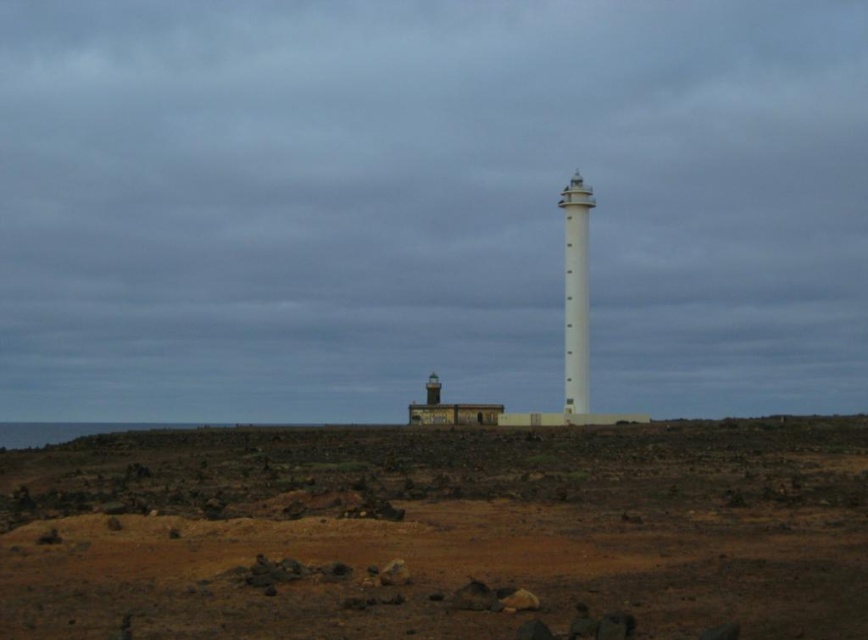
Question: Is brown dirt at lower center positioned in front of white smooth tower at center?

Choices:
 (A) yes
 (B) no

Answer: (A)

Question: Which point appears closest to the camera in this image?

Choices:
 (A) (333, 580)
 (B) (580, 177)

Answer: (A)

Question: Can you confirm if brown dirt at lower center is positioned above white smooth tower at center?

Choices:
 (A) yes
 (B) no

Answer: (B)

Question: Which point is farther to the camera?

Choices:
 (A) (774, 424)
 (B) (584, 296)

Answer: (B)

Question: Can you confirm if brown dirt at lower center is thinner than white smooth tower at center?

Choices:
 (A) no
 (B) yes

Answer: (A)

Question: Among these points, which one is nearest to the camera?

Choices:
 (A) (567, 192)
 (B) (403, 432)

Answer: (A)